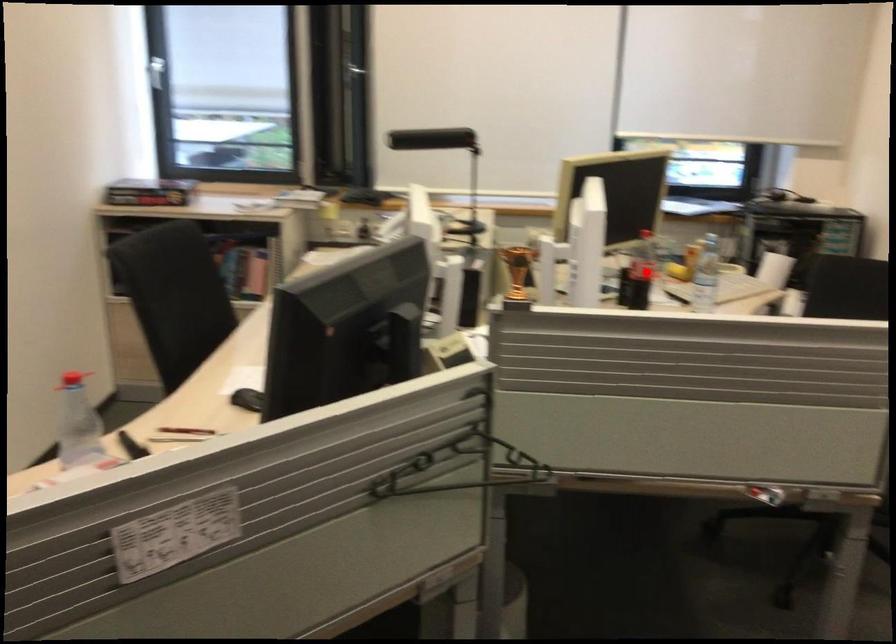
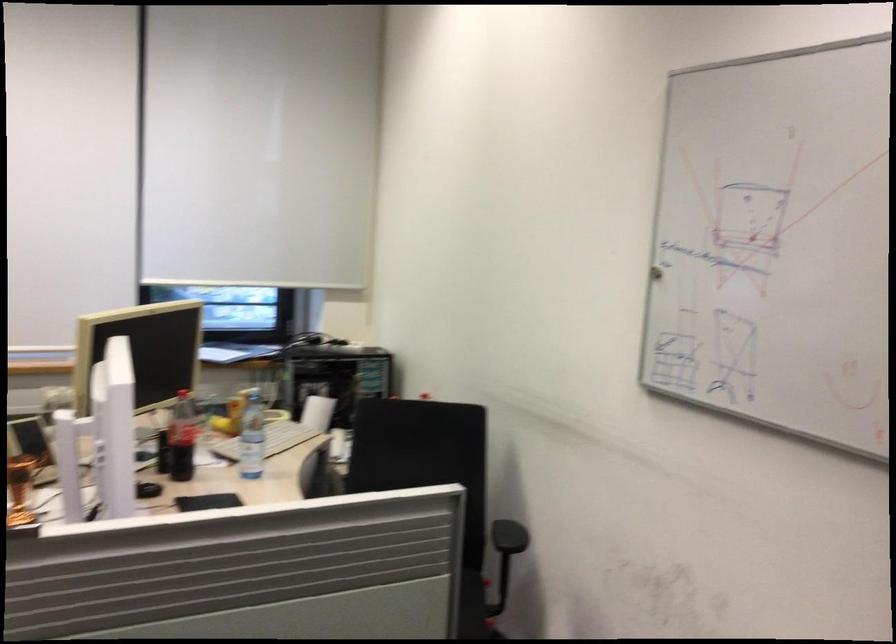
In the second image, find the point that corresponds to the highlighted location in the first image.

(182, 438)